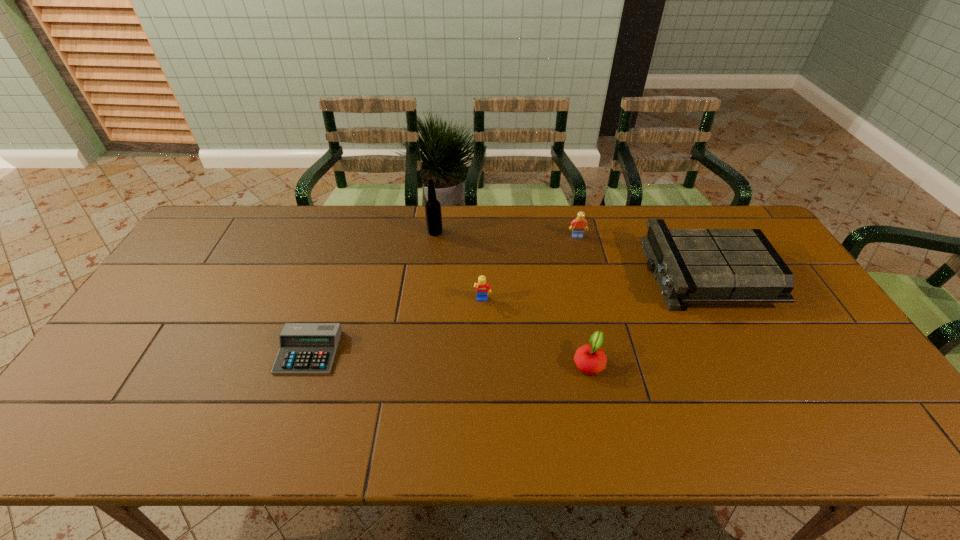
Locate an element on the screen. This screenshot has height=540, width=960. vacant area situated on the front-facing side of the farther Lego is located at coordinates (587, 273).

Identify the location of free space located 0.360m on the front panel of the radio receiver. (531, 274).

Locate an element on the screen. The width and height of the screenshot is (960, 540). free spot located on the front panel of the radio receiver is located at coordinates (553, 274).

At what (x,y) coordinates should I click in order to perform the action: click on free space located on the front panel of the radio receiver. Please return your answer as a coordinate pair (x, y). This screenshot has width=960, height=540. Looking at the image, I should click on 583,274.

Locate an element on the screen. vacant space located on the face of the nearer Lego is located at coordinates (483, 354).

Identify the location of free region located 0.390m on the back of the apple. (564, 251).

Identify the location of vacant area located 0.180m on the right of the calculator. The width and height of the screenshot is (960, 540). (406, 352).

You are a GUI agent. You are given a task and a screenshot of the screen. Output one action in this format:
    pyautogui.click(x=<x>, y=<y>)
    Task: Click on the beer bottle that is at the far edge
    
    Given the screenshot: What is the action you would take?
    pyautogui.click(x=433, y=213)

The image size is (960, 540). Find the location of `Lego that is positioned at the far edge`. Lego that is positioned at the far edge is located at coordinates (578, 225).

You are a GUI agent. You are given a task and a screenshot of the screen. Output one action in this format:
    pyautogui.click(x=<x>, y=<y>)
    Task: Click on the radio receiver that is at the far edge
    The height and width of the screenshot is (540, 960).
    Given the screenshot: What is the action you would take?
    [690, 265]